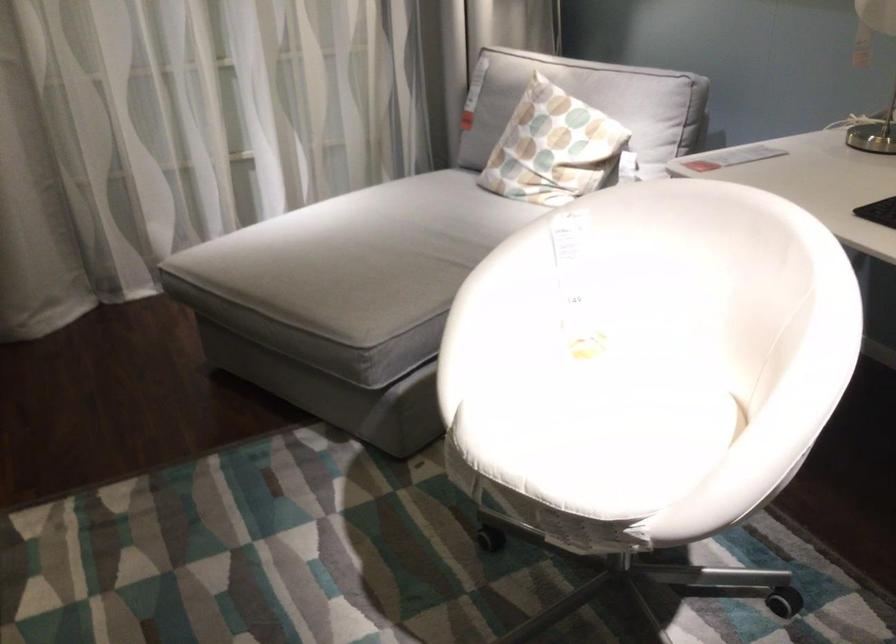
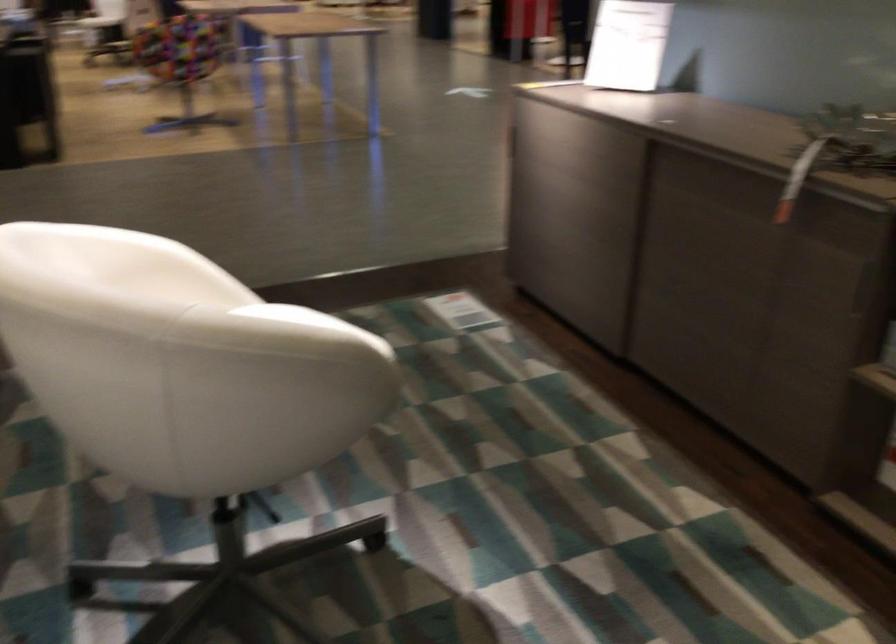
The point at (495, 251) is marked in the first image. Where is the corresponding point in the second image?

(307, 321)